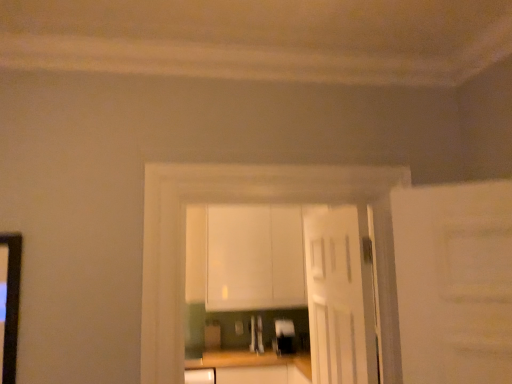
Measure the distance between satin silver toaster at center, which appears as the second appliance when viewed from the right, and camera.

The depth of satin silver toaster at center, which appears as the second appliance when viewed from the right, is 12.67 feet.

Where is `white wooden door at center`? Image resolution: width=512 pixels, height=384 pixels. white wooden door at center is located at coordinates (340, 297).

Locate an element on the screen. Image resolution: width=512 pixels, height=384 pixels. white glossy cabinets at center is located at coordinates pyautogui.click(x=289, y=291).

The height and width of the screenshot is (384, 512). Identify the location of wooden at center. (252, 365).

Image resolution: width=512 pixels, height=384 pixels. What do you see at coordinates (252, 365) in the screenshot?
I see `wooden at center` at bounding box center [252, 365].

You are a GUI agent. You are given a task and a screenshot of the screen. Output one action in this format:
    pyautogui.click(x=<x>, y=<y>)
    Task: Click on the satin silver toaster at center, which appears as the second appliance when viewed from the right
    
    Given the screenshot: What is the action you would take?
    pyautogui.click(x=256, y=335)

Looking at this image, from a real-world perspective, is white matte cabinet at center above or below white wooden door at center?

In terms of real-world spatial position, white matte cabinet at center is above white wooden door at center.

Which object is wider, white matte cabinet at center or white wooden door at center?

With larger width is white matte cabinet at center.

Consider the image. Is white matte cabinet at center in front of or behind white wooden door at center in the image?

In the image, white matte cabinet at center appears behind white wooden door at center.

Are white matte cabinet at center and white wooden door at center located far from each other?

That's right, there is a large distance between white matte cabinet at center and white wooden door at center.

From the image's perspective, who appears lower, satin silver toaster at center, which appears as the second appliance when viewed from the right, or metallic silver toaster at center, acting as the 2th appliance starting from the left?

From the image's view, metallic silver toaster at center, acting as the 2th appliance starting from the left, is below.

Is satin silver toaster at center, acting as the first appliance starting from the left, far from metallic silver toaster at center, the first appliance viewed from the right?

No.

Is satin silver toaster at center, which appears as the second appliance when viewed from the right, positioned with its back to metallic silver toaster at center, acting as the 2th appliance starting from the left?

That's not correct — satin silver toaster at center, which appears as the second appliance when viewed from the right, is not looking away from metallic silver toaster at center, acting as the 2th appliance starting from the left.

Considering the points (260, 336) and (282, 320), which point is behind, point (260, 336) or point (282, 320)?

The point (260, 336) is more distant.

This screenshot has width=512, height=384. Identify the location of the 2nd appliance to the left of the white wooden door at center, starting your count from the anchor. (256, 335).

Is point (355, 271) positioned behind point (252, 343)?

No, (355, 271) is closer to viewer.

Can we say white wooden door at center lies outside satin silver toaster at center, which appears as the second appliance when viewed from the right?

Absolutely, white wooden door at center is external to satin silver toaster at center, which appears as the second appliance when viewed from the right.

From their relative heights in the image, would you say white wooden door at center is taller or shorter than satin silver toaster at center, which appears as the second appliance when viewed from the right?

In the image, white wooden door at center appears to be taller than satin silver toaster at center, which appears as the second appliance when viewed from the right.

Is point (257, 368) closer to viewer compared to point (291, 329)?

Yes, it is in front of point (291, 329).

Can you confirm if wooden at center is taller than metallic silver toaster at center, acting as the 2th appliance starting from the left?

Yes, wooden at center is taller than metallic silver toaster at center, acting as the 2th appliance starting from the left.

Is wooden at center not near metallic silver toaster at center, acting as the 2th appliance starting from the left?

Actually, wooden at center and metallic silver toaster at center, acting as the 2th appliance starting from the left, are a little close together.

Between white matte cabinet at center and satin silver toaster at center, acting as the first appliance starting from the left, which one appears on the left side from the viewer's perspective?

white matte cabinet at center is more to the left.

Locate an element on the screen. cabinetry that appears on the left of satin silver toaster at center, acting as the first appliance starting from the left is located at coordinates click(254, 258).

Between point (223, 280) and point (257, 351), which one is positioned in front?

The point (223, 280) is more forward.

Are white matte cabinet at center and satin silver toaster at center, which appears as the second appliance when viewed from the right, making contact?

white matte cabinet at center and satin silver toaster at center, which appears as the second appliance when viewed from the right, are clearly separated.

How much distance is there between white matte cabinet at center and metallic silver toaster at center, the first appliance viewed from the right?

white matte cabinet at center is 23.92 inches away from metallic silver toaster at center, the first appliance viewed from the right.

Between white matte cabinet at center and metallic silver toaster at center, acting as the 2th appliance starting from the left, which one appears on the right side from the viewer's perspective?

metallic silver toaster at center, acting as the 2th appliance starting from the left.

From the white matte cabinet at center, count 1st appliances backward and point to it. Please provide its 2D coordinates.

[(284, 337)]

Does white matte cabinet at center contain metallic silver toaster at center, acting as the 2th appliance starting from the left?

No, metallic silver toaster at center, acting as the 2th appliance starting from the left, is located outside of white matte cabinet at center.

Would you say white matte cabinet at center contains wooden at center?

Actually, wooden at center is outside white matte cabinet at center.

Can you tell me how much white matte cabinet at center and wooden at center differ in facing direction?

They differ by 0.0793 degrees in their facing directions.

Where is `counter top on the left of white matte cabinet at center`? The height and width of the screenshot is (384, 512). counter top on the left of white matte cabinet at center is located at coordinates (252, 365).

I want to click on door that appears on the right of white matte cabinet at center, so click(x=340, y=297).

Locate an element on the screen. The height and width of the screenshot is (384, 512). appliance above the metallic silver toaster at center, the first appliance viewed from the right (from a real-world perspective) is located at coordinates (256, 335).

Based on their spatial positions, is white glossy cabinets at center or white matte cabinet at center closer to white wooden door at center?

white matte cabinet at center is closer to white wooden door at center.

Looking at the image, which one is located closer to white matte cabinet at center, satin silver toaster at center, which appears as the second appliance when viewed from the right, or white glossy cabinets at center?

Based on the image, white glossy cabinets at center appears to be nearer to white matte cabinet at center.

When comparing their distances from white matte cabinet at center, does wooden at center or metallic silver toaster at center, acting as the 2th appliance starting from the left, seem closer?

metallic silver toaster at center, acting as the 2th appliance starting from the left, is positioned closer to the anchor white matte cabinet at center.

Which object lies nearer to the anchor point white glossy cabinets at center, white matte cabinet at center or wooden at center?

white matte cabinet at center lies closer to white glossy cabinets at center than the other object.

Based on their spatial positions, is metallic silver toaster at center, acting as the 2th appliance starting from the left, or white matte cabinet at center closer to satin silver toaster at center, which appears as the second appliance when viewed from the right?

metallic silver toaster at center, acting as the 2th appliance starting from the left, lies closer to satin silver toaster at center, which appears as the second appliance when viewed from the right, than the other object.

From the image, which object appears to be farther from wooden at center, white wooden door at center or white matte cabinet at center?

The object further to wooden at center is white wooden door at center.

Considering their positions, is white glossy cabinets at center positioned closer to satin silver toaster at center, which appears as the second appliance when viewed from the right, than wooden at center?

white glossy cabinets at center is closer to satin silver toaster at center, which appears as the second appliance when viewed from the right.

Based on their spatial positions, is white wooden door at center or wooden at center closer to white glossy cabinets at center?

wooden at center is closer to white glossy cabinets at center.

Locate an element on the screen. The height and width of the screenshot is (384, 512). cabinetry between white wooden door at center and satin silver toaster at center, acting as the first appliance starting from the left, along the z-axis is located at coordinates (254, 258).

Locate an element on the screen. The width and height of the screenshot is (512, 384). door between white glossy cabinets at center and white matte cabinet at center along the z-axis is located at coordinates (340, 297).

At what (x,y) coordinates should I click in order to perform the action: click on counter top between white wooden door at center and metallic silver toaster at center, acting as the 2th appliance starting from the left, in the front-back direction. Please return your answer as a coordinate pair (x, y). The width and height of the screenshot is (512, 384). Looking at the image, I should click on (252, 365).

Locate an element on the screen. counter top between white glossy cabinets at center and metallic silver toaster at center, acting as the 2th appliance starting from the left, along the z-axis is located at coordinates (252, 365).